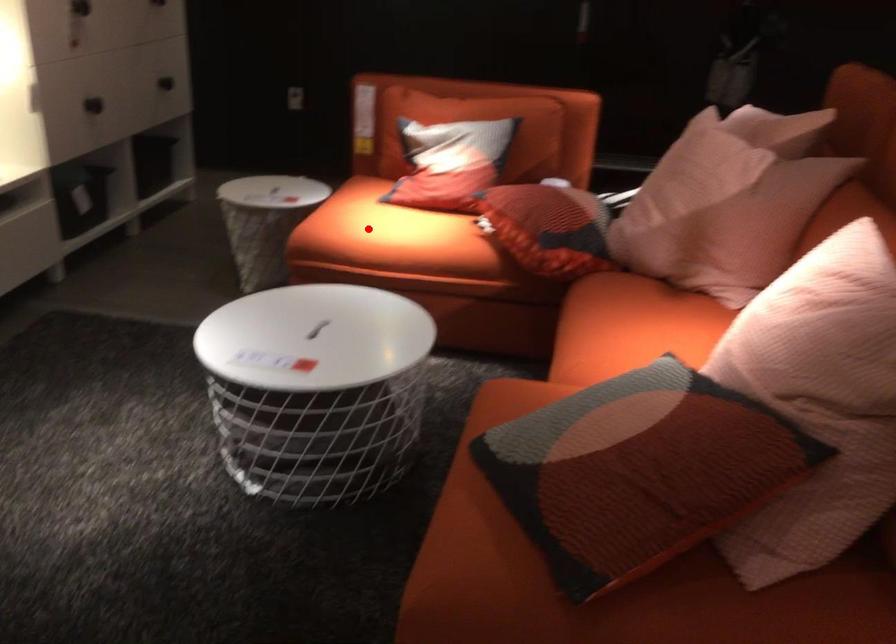
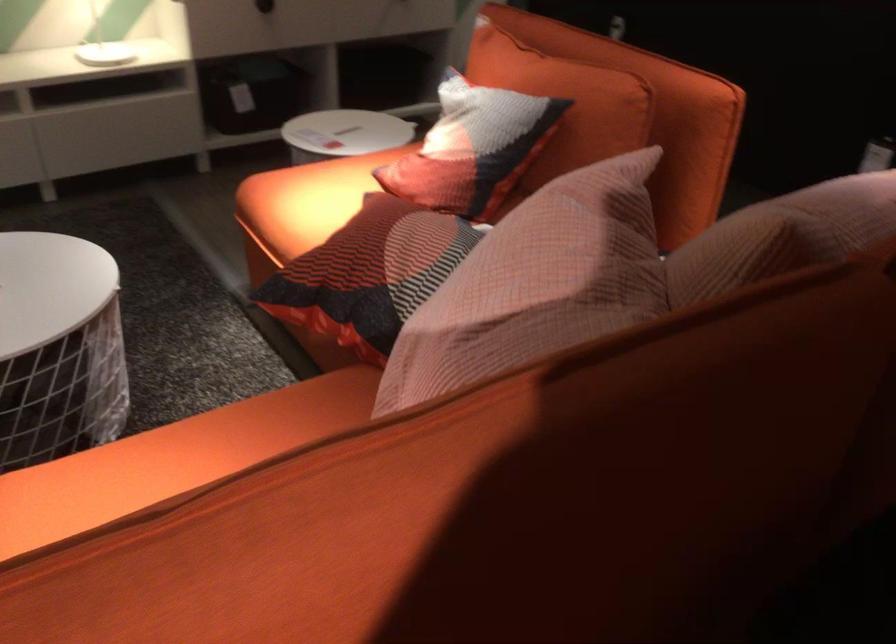
Question: I am providing you with two images of the same scene from different viewpoints. In image1, a red point is highlighted. Considering the same 3D point in image2, which of the following is correct?

Choices:
 (A) It is closer
 (B) It is farther

Answer: (A)